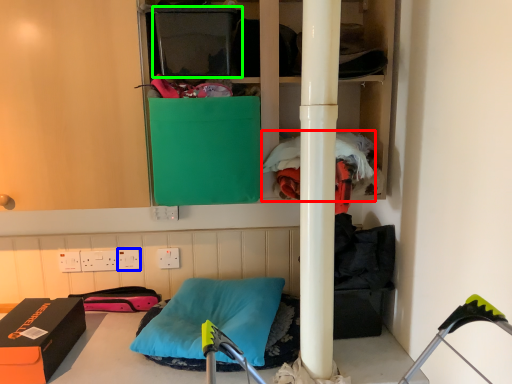
Question: Considering the real-world distances, which object is closest to clothing (highlighted by a red box)? electric outlet (highlighted by a blue box) or box (highlighted by a green box).

Choices:
 (A) electric outlet
 (B) box

Answer: (B)